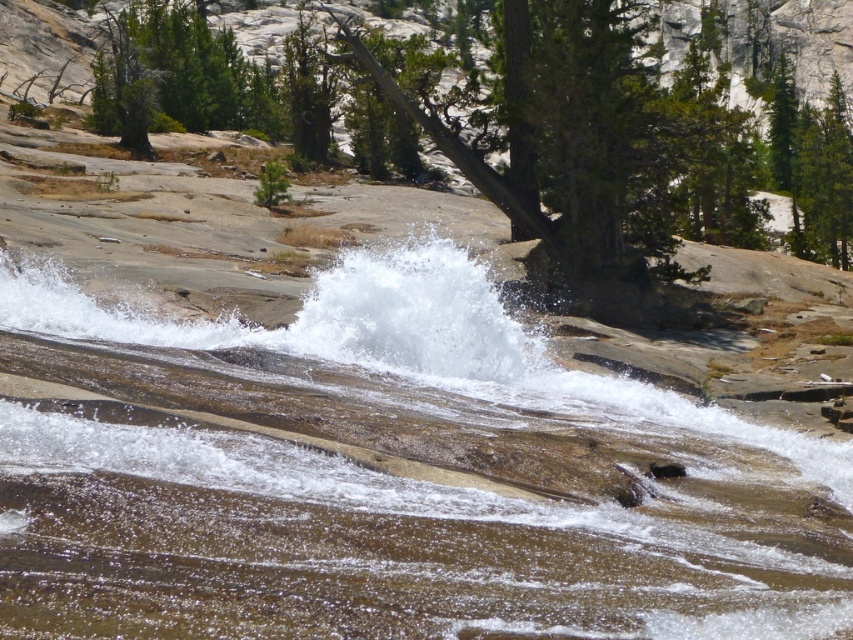
Consider the image. You are standing at the edge of the waterfall and see the white frothy water at center and the green textured tree at center. Which one is taller?

The white frothy water at center has a lesser height compared to the green textured tree at center, so the green textured tree at center is taller.

You are standing at the edge of the waterfall and see the white frothy water at center and the green textured tree at center. Which object is closer to your left side?

The white frothy water at center is to the left of green textured tree at center, so it is closer to your left side.